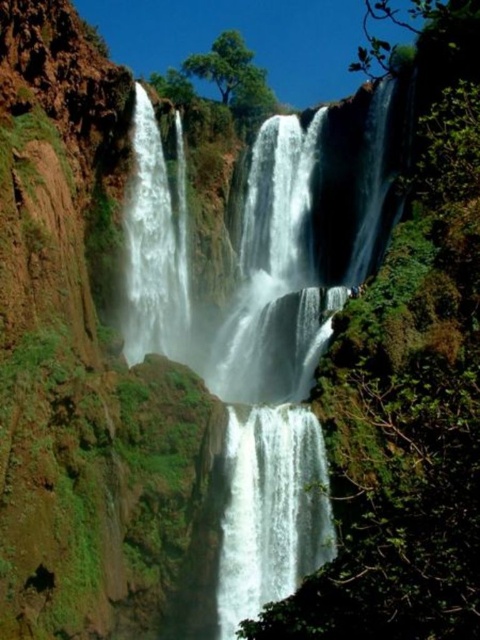
Who is shorter, white water at center or white smooth waterfall at center?

white smooth waterfall at center is shorter.

Who is more forward, (269, 333) or (269, 561)?

Point (269, 561) is more forward.

This screenshot has height=640, width=480. In order to click on white water at center in this screenshot , I will do `click(262, 321)`.

Does white water at center have a larger size compared to white smooth waterfall at left?

Correct, white water at center is larger in size than white smooth waterfall at left.

The image size is (480, 640). Describe the element at coordinates (262, 321) in the screenshot. I see `white water at center` at that location.

I want to click on white water at center, so click(x=262, y=321).

Is white smooth waterfall at center positioned at the back of white smooth waterfall at left?

No, it is in front of white smooth waterfall at left.

Who is shorter, white smooth waterfall at center or white smooth waterfall at left?

white smooth waterfall at center is shorter.

Does point (228, 467) come in front of point (133, 307)?

Yes, it is in front of point (133, 307).

Image resolution: width=480 pixels, height=640 pixels. I want to click on white smooth waterfall at center, so click(271, 509).